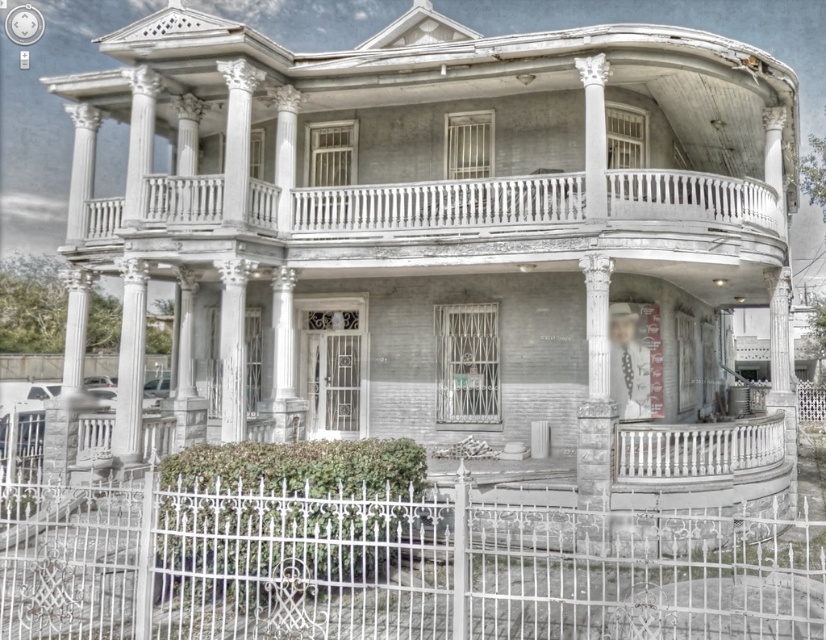
Question: Considering the relative positions of white wrought iron fence at lower center and white wood balustrade at lower right in the image provided, where is white wrought iron fence at lower center located with respect to white wood balustrade at lower right?

Choices:
 (A) above
 (B) below

Answer: (B)

Question: Which of the following is the closest to the observer?

Choices:
 (A) white wood balustrade at lower right
 (B) white wrought iron fence at lower center

Answer: (B)

Question: Among these points, which one is nearest to the camera?

Choices:
 (A) pyautogui.click(x=625, y=451)
 (B) pyautogui.click(x=551, y=608)

Answer: (B)

Question: Can you confirm if white wrought iron fence at lower center is positioned to the right of white wood balustrade at lower right?

Choices:
 (A) yes
 (B) no

Answer: (B)

Question: Can you confirm if white wrought iron fence at lower center is wider than white wood balustrade at lower right?

Choices:
 (A) no
 (B) yes

Answer: (A)